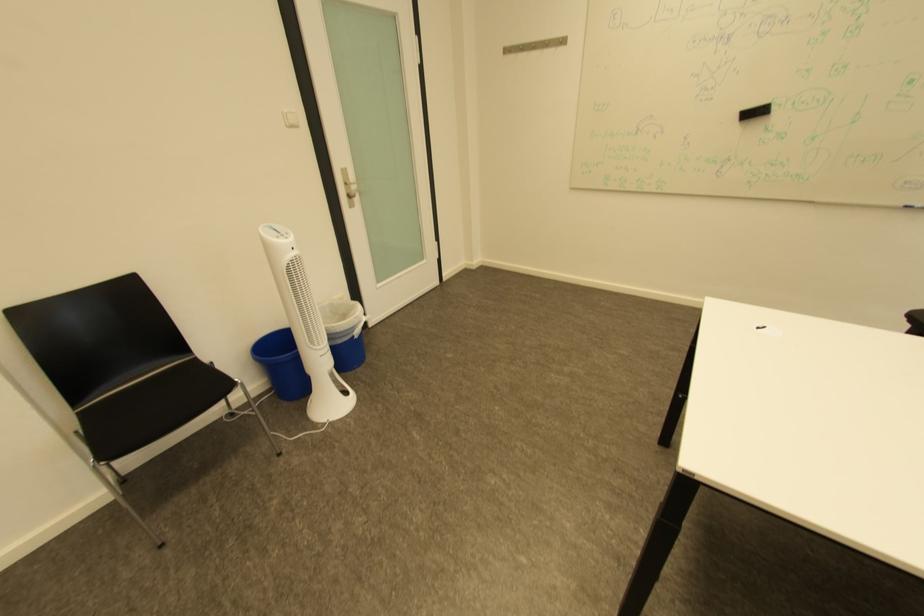
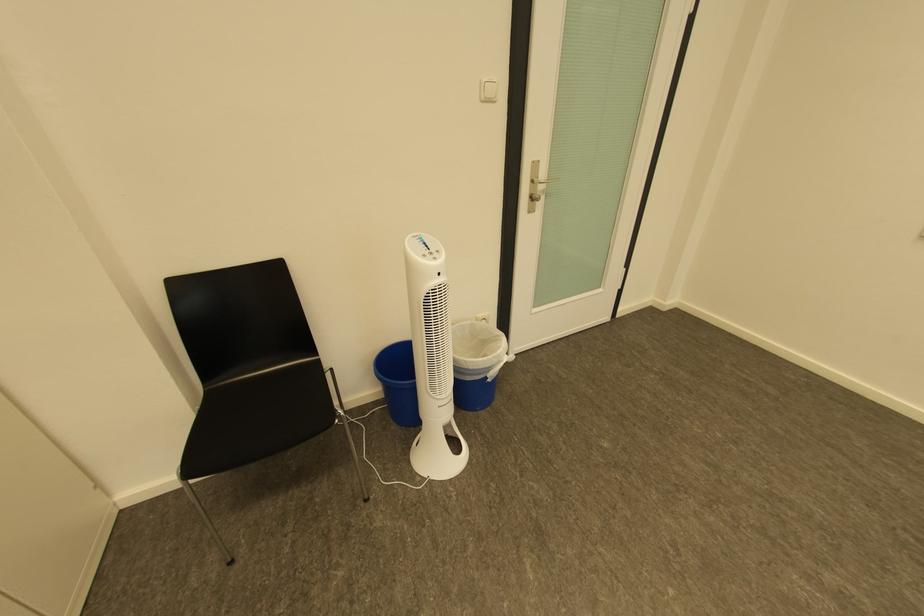
Find the pixel in the second image that matches point (292, 403) in the first image.

(402, 422)